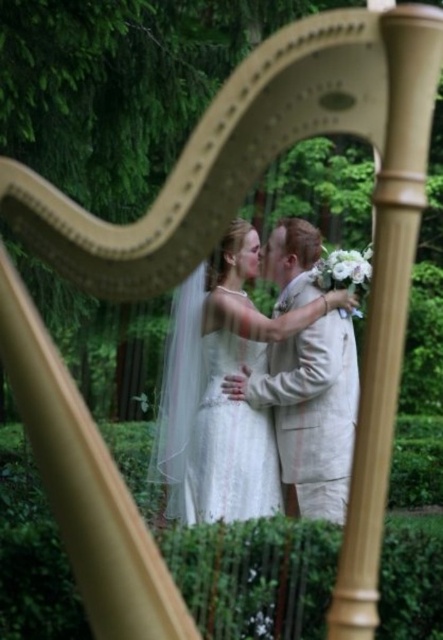
You are a photographer trying to capture the perfect shot of the light beige linen suit at center and the white lace dress at center. The minimum distance required for your camera to focus clearly on both subjects simultaneously is 10 inches. Based on the scene, will your camera be able to focus on both subjects?

The light beige linen suit at center and white lace dress at center are 9.97 inches apart, which is less than the required 10 inches. Therefore, the camera cannot focus on both subjects simultaneously.

You are a photographer at a wedding and need to adjust the lighting to ensure both the white satin dress at center and the light beige linen suit at center are equally visible. Given their sizes, which one might require more focused lighting adjustments?

The white satin dress at center is bigger than the light beige linen suit at center, so it might require more focused lighting adjustments to ensure it stands out appropriately.